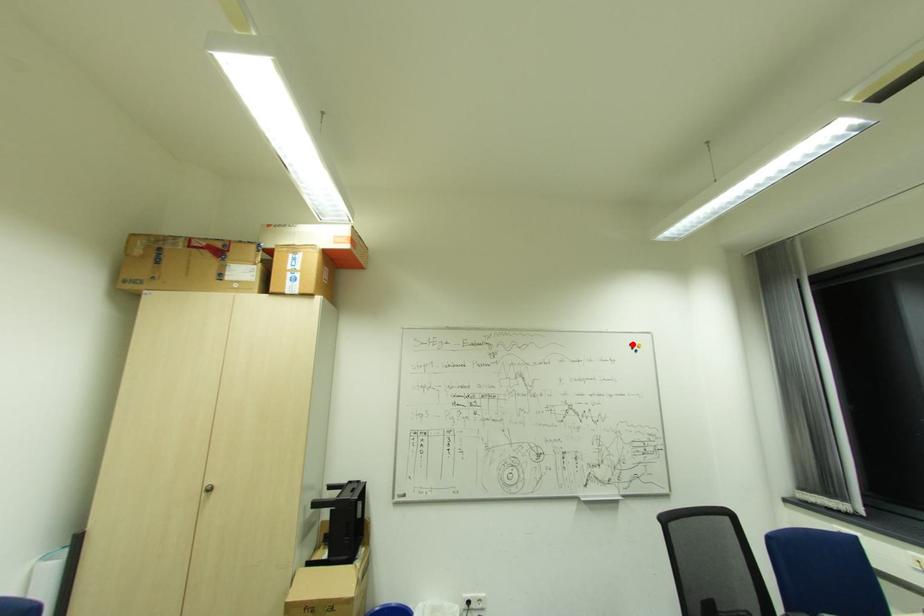
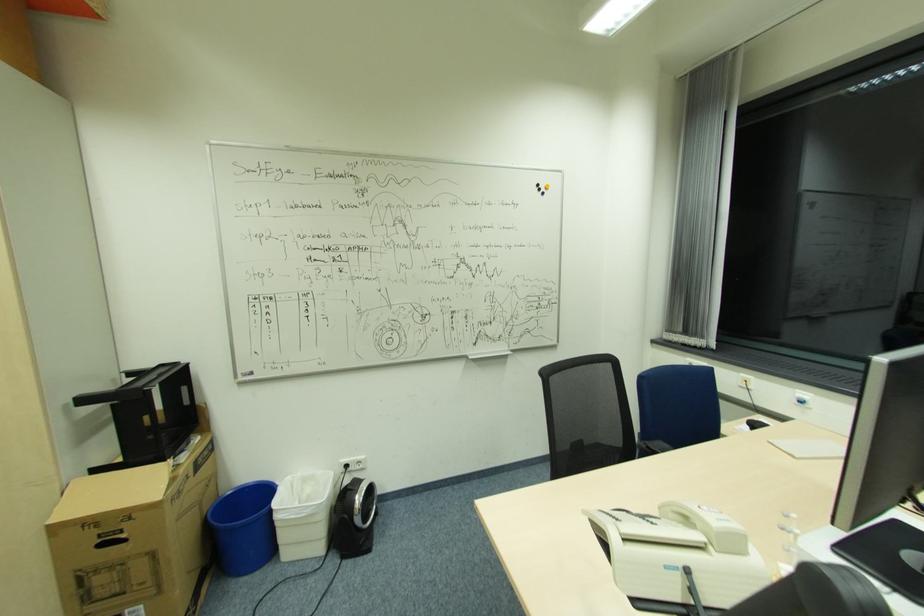
The point at the highlighted location is marked in the first image. Where is the corresponding point in the second image?

(541, 185)